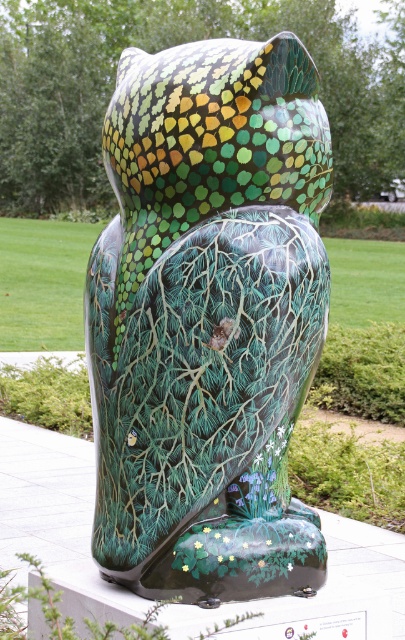
Can you confirm if glossy ceramic owl at center is positioned above green glossy owl at center?

Actually, glossy ceramic owl at center is below green glossy owl at center.

Is glossy ceramic owl at center further to the viewer compared to green glossy owl at center?

No, it is not.

Which is behind, point (266, 80) or point (98, 90)?

The point (98, 90) is more distant.

Locate an element on the screen. glossy ceramic owl at center is located at coordinates (208, 320).